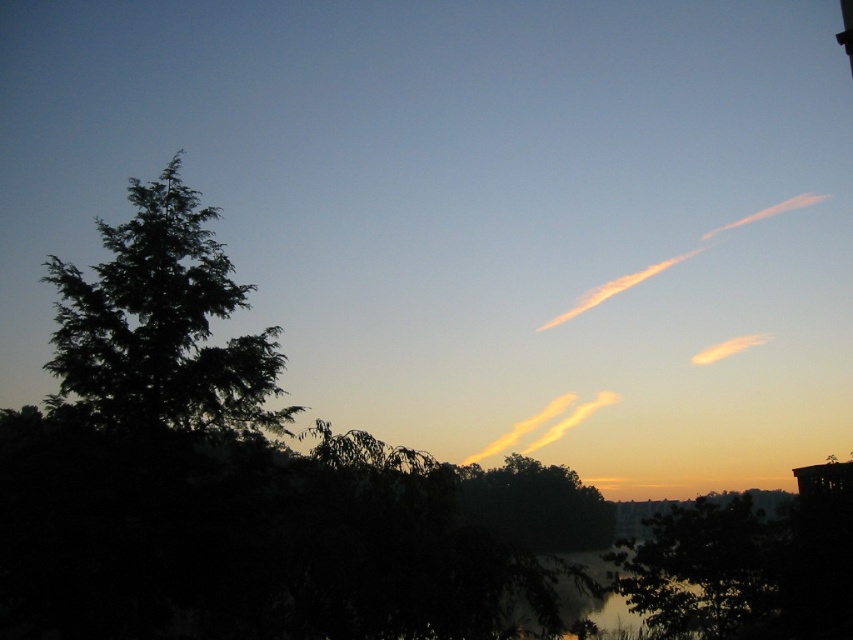
You are standing in the sunset scene and want to place a small birdhouse. You have two options for placement based on coordinates given in the image. The first option is at point (705, 243) and the second is at point (721, 353). Which point is closer to you so the birdhouse will be more visible?

Point (705, 243) is closer to the camera than point (721, 353), so placing the birdhouse there will make it more visible.

You are an astronomer observing the sunset scene. You notice two clouds in the upper right corner. Which cloud is closer to you, the pastel pink cotton cloud at upper right or the translucent orange cloud at upper right?

The pastel pink cotton cloud at upper right is closer to you because it is in front of the translucent orange cloud at upper right.